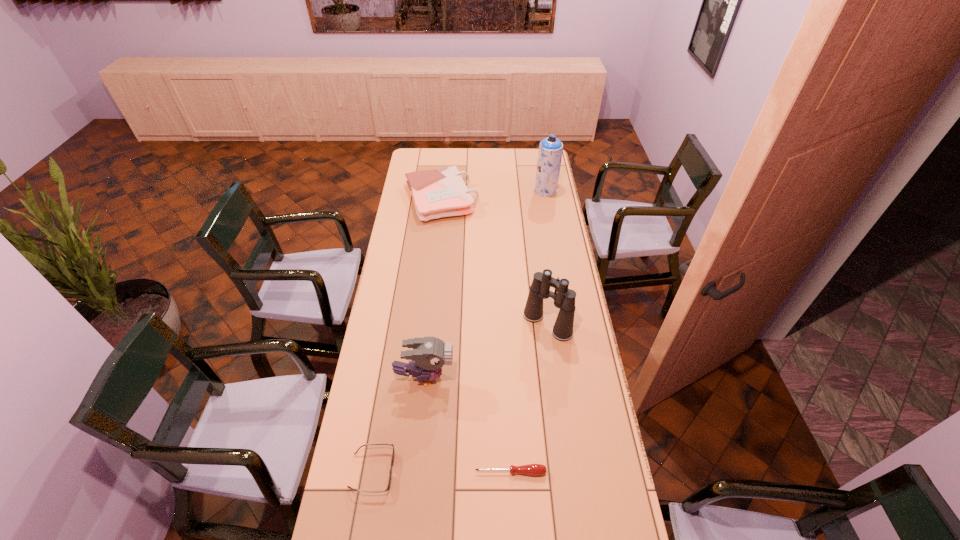
You are a GUI agent. You are given a task and a screenshot of the screen. Output one action in this format:
    pyautogui.click(x=<x>, y=<y>)
    Task: Click on the aerosol can
    This screenshot has height=540, width=960.
    Given the screenshot: What is the action you would take?
    pyautogui.click(x=550, y=151)

Identify the location of binoculars. The width and height of the screenshot is (960, 540). (564, 298).

This screenshot has height=540, width=960. I want to click on the fifth shortest object, so click(x=564, y=298).

Identify the location of the fourth farthest object. (429, 354).

The image size is (960, 540). Find the location of `the fourth shortest object`. the fourth shortest object is located at coordinates (429, 354).

Find the location of a particular element. This screenshot has height=540, width=960. phonebook is located at coordinates (437, 193).

Locate an element on the screen. This screenshot has height=540, width=960. sunglasses is located at coordinates (390, 473).

This screenshot has height=540, width=960. What are the coordinates of `screwdriver` in the screenshot? It's located at (530, 469).

This screenshot has width=960, height=540. Find the location of `vacant area located 0.320m on the back of the aerosol can`. vacant area located 0.320m on the back of the aerosol can is located at coordinates (540, 153).

Where is `free location located on the front of the fifth shortest object`? free location located on the front of the fifth shortest object is located at coordinates (564, 444).